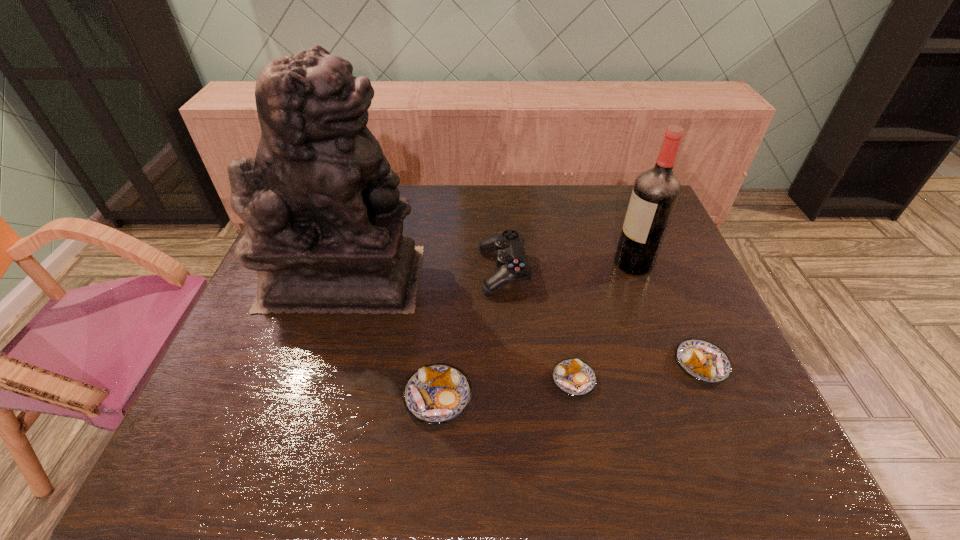
The image size is (960, 540). I want to click on the tallest pastry, so click(435, 394).

Identify the location of the fourth tallest object. (435, 394).

This screenshot has height=540, width=960. Identify the location of the shortest object. (574, 377).

Locate an element on the screen. The width and height of the screenshot is (960, 540). the shortest pastry is located at coordinates (574, 377).

Find the location of a particular element. This screenshot has width=960, height=540. the rightmost pastry is located at coordinates (702, 360).

Identify the location of the second shortest object. The width and height of the screenshot is (960, 540). (702, 360).

This screenshot has width=960, height=540. In order to click on the leftmost object in this screenshot , I will do `click(324, 218)`.

This screenshot has height=540, width=960. I want to click on the tallest object, so click(324, 218).

This screenshot has width=960, height=540. I want to click on the second tallest object, so click(x=656, y=191).

Image resolution: width=960 pixels, height=540 pixels. Find the location of `control`. control is located at coordinates (511, 260).